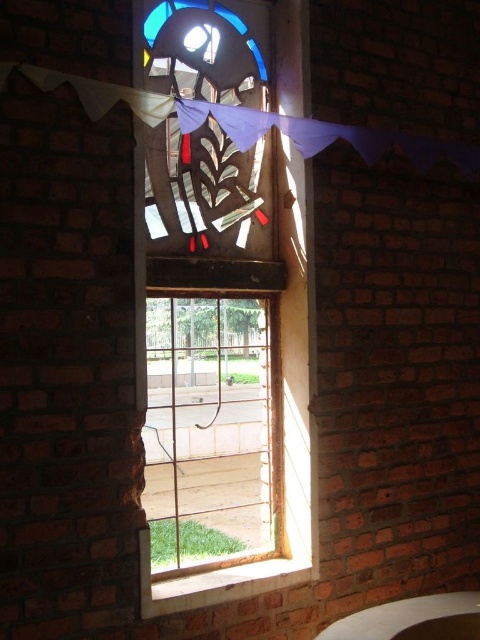
Who is taller, stained glass window at center or clear glass window at center?

With more height is stained glass window at center.

Does stained glass window at center have a larger size compared to clear glass window at center?

Yes.

Which is behind, point (304, 246) or point (257, 305)?

The point (257, 305) is behind.

This screenshot has height=640, width=480. What are the coordinates of `stained glass window at center` in the screenshot? It's located at (228, 394).